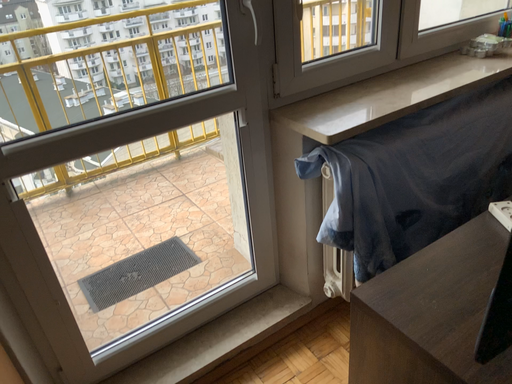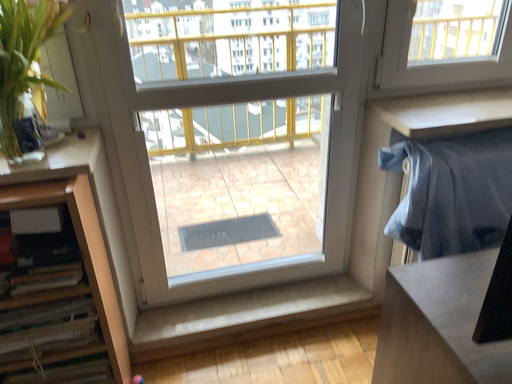
Question: How did the camera likely rotate when shooting the video?

Choices:
 (A) rotated right
 (B) rotated left

Answer: (B)